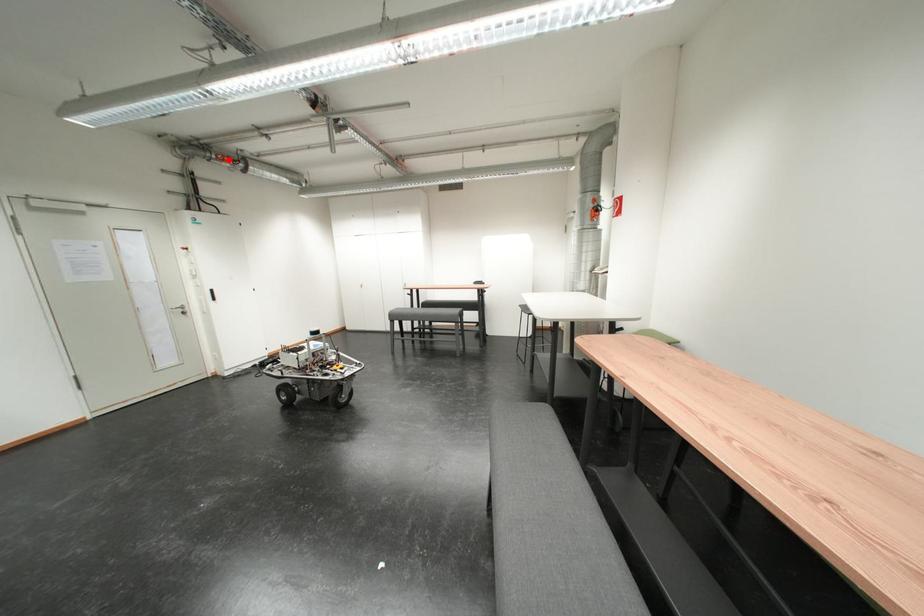
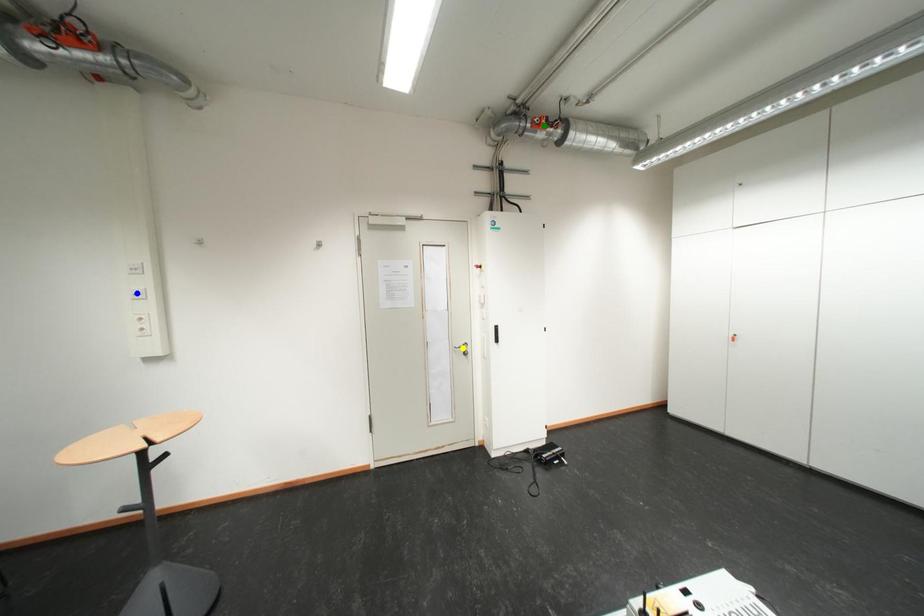
Question: I am providing you with two images of the same scene from different viewpoints. A red point is marked on the first image. You are given multiple points on the second image. Can you choose the point in image 2 that corresponds to the point in image 1?

Choices:
 (A) blue point
 (B) yellow point
 (C) green point

Answer: (C)